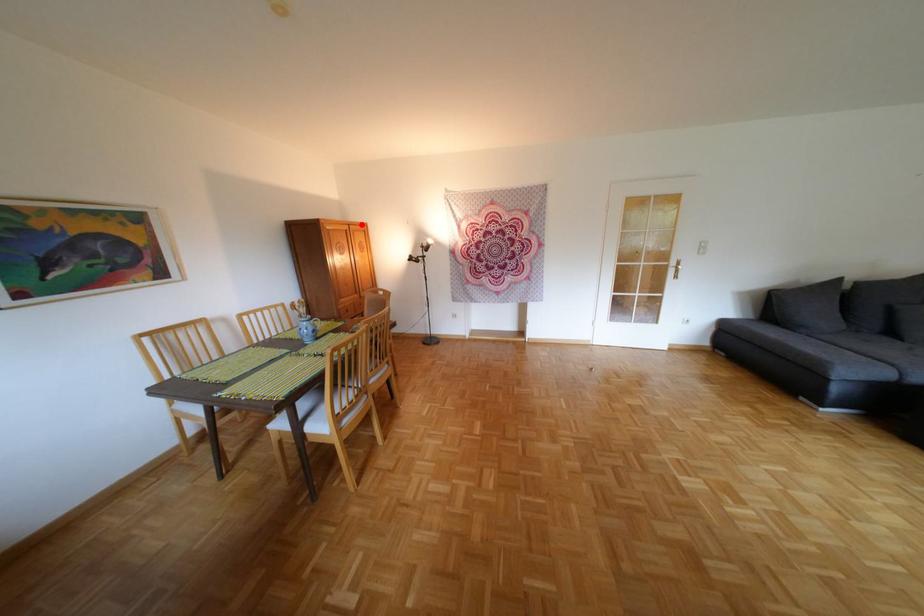
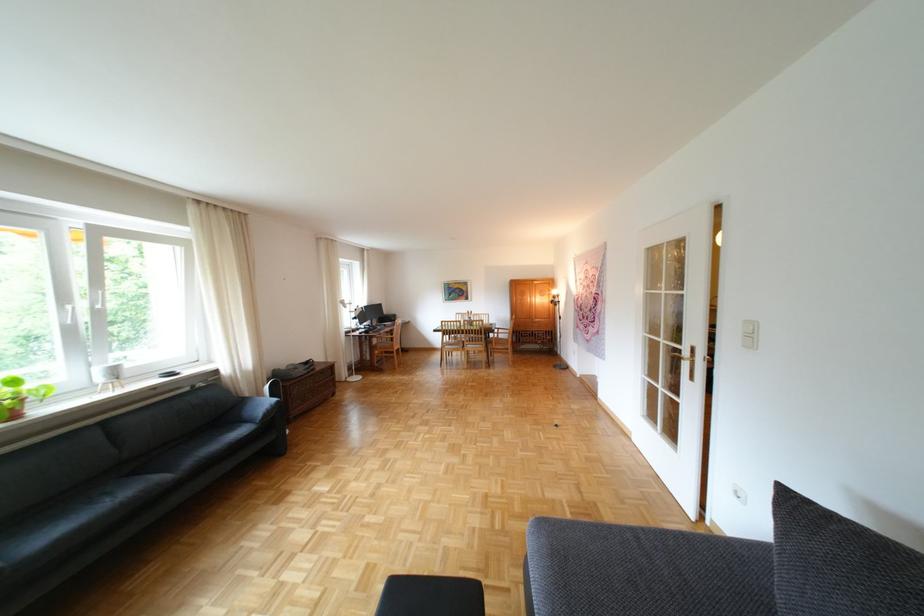
Locate, in the second image, the point that corresponds to the highlighted location in the first image.

(544, 281)